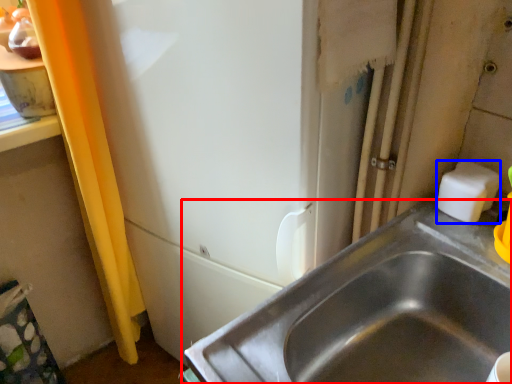
Question: Among these objects, which one is nearest to the camera, sink (highlighted by a red box) or soap (highlighted by a blue box)?

Choices:
 (A) sink
 (B) soap

Answer: (A)